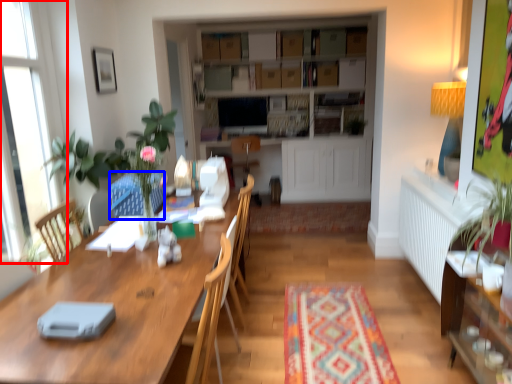
Question: Which object is further to the camera taking this photo, window (highlighted by a red box) or swivel chair (highlighted by a blue box)?

Choices:
 (A) window
 (B) swivel chair

Answer: (B)